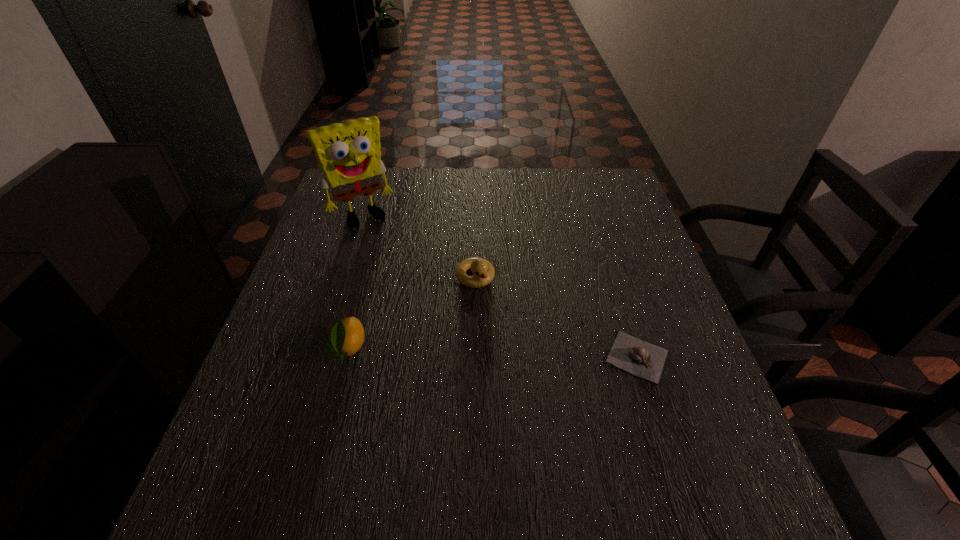
Locate an element on the screen. The height and width of the screenshot is (540, 960). lemon is located at coordinates (347, 336).

The height and width of the screenshot is (540, 960). Find the location of `the shortest object`. the shortest object is located at coordinates (646, 360).

Image resolution: width=960 pixels, height=540 pixels. What are the coordinates of `garlic` in the screenshot? It's located at (646, 360).

In order to click on the tallest object in this screenshot , I will do `click(349, 155)`.

Where is `sponge`? The height and width of the screenshot is (540, 960). sponge is located at coordinates click(x=349, y=155).

The width and height of the screenshot is (960, 540). I want to click on the third object from left to right, so click(483, 271).

The width and height of the screenshot is (960, 540). Identify the location of the third nearest object. (483, 271).

Where is `vacant region located 0.120m with leaves positioned above the lemon`? The height and width of the screenshot is (540, 960). vacant region located 0.120m with leaves positioned above the lemon is located at coordinates (327, 426).

At what (x,y) coordinates should I click in order to perform the action: click on vacant region located on the back of the rightmost object. Please return your answer as a coordinate pair (x, y). Looking at the image, I should click on (609, 264).

Where is `blank space located 0.060m on the face of the sponge`? Image resolution: width=960 pixels, height=540 pixels. blank space located 0.060m on the face of the sponge is located at coordinates click(382, 240).